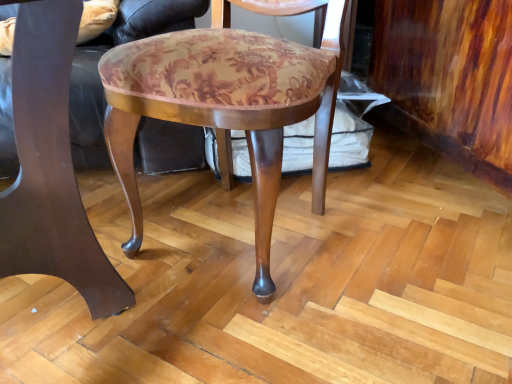
In order to click on vacant space to the right of matte brown wood chair at center, the 1th chair from the left in this screenshot , I will do `click(284, 321)`.